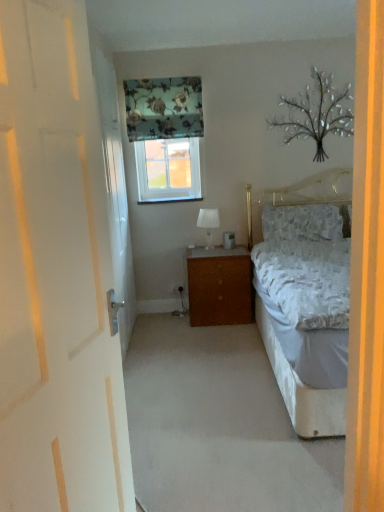
You are a GUI agent. You are given a task and a screenshot of the screen. Output one action in this format:
    pyautogui.click(x=<x>, y=<y>)
    Task: Click on the free space in front of white fabric lampshade at center
    The width and height of the screenshot is (384, 512).
    Given the screenshot: What is the action you would take?
    pyautogui.click(x=203, y=250)